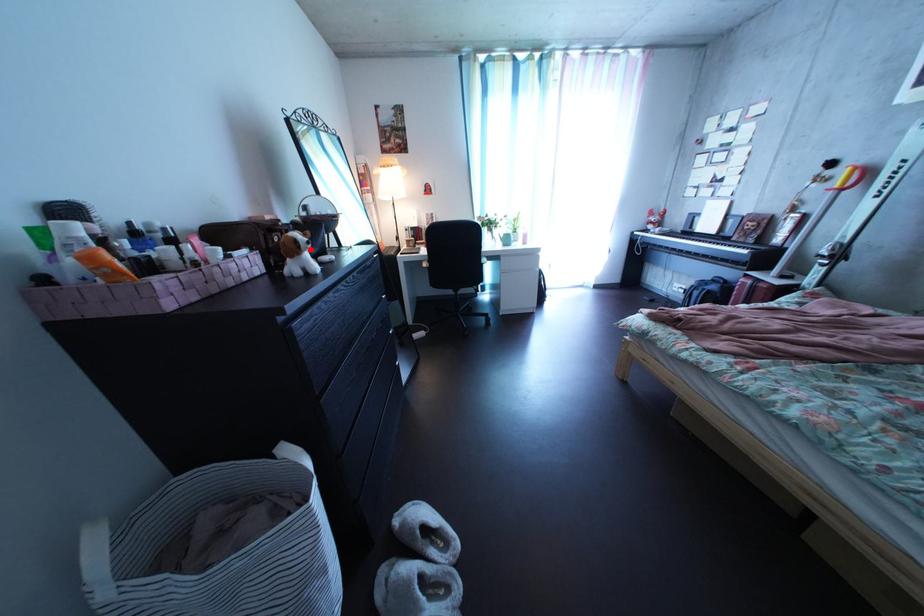
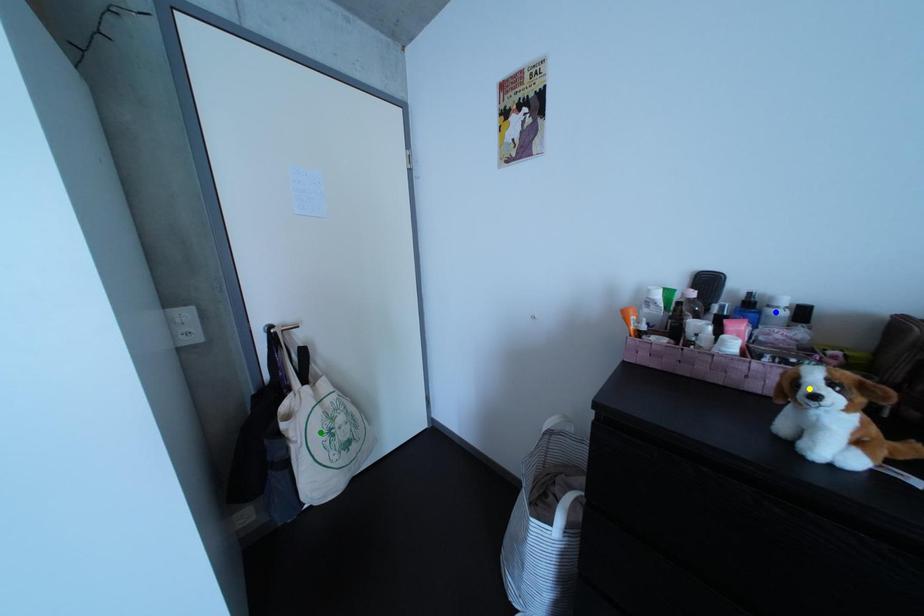
Question: I am providing you with two images of the same scene from different viewpoints. A red point is marked on the first image. You are given multiple points on the second image. Which mark in image 2 goes with the point in image 1?

Choices:
 (A) blue point
 (B) green point
 (C) yellow point

Answer: (C)